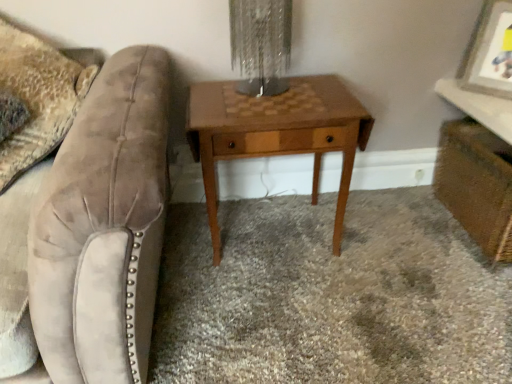
Question: Is wooden picture frame at upper right bigger or smaller than brown wood table at center?

Choices:
 (A) small
 (B) big

Answer: (A)

Question: Based on their positions, is wooden picture frame at upper right located to the left or right of brown wood table at center?

Choices:
 (A) right
 (B) left

Answer: (A)

Question: Which object is the farthest from the metallic textured lampshade at center?

Choices:
 (A) velvet swivel chair at left
 (B) wooden vanity at lower right
 (C) velvet beige throw pillow at left
 (D) wooden picture frame at upper right
 (E) woodenmaterial/texturenightstand at center

Answer: (D)

Question: Estimate the real-world distances between objects in this image. Which object is closer to the metallic textured lampshade at center?

Choices:
 (A) velvet swivel chair at left
 (B) woodenmaterial/texturenightstand at center
 (C) brown wood table at center
 (D) wooden vanity at lower right
 (E) wooden picture frame at upper right

Answer: (B)